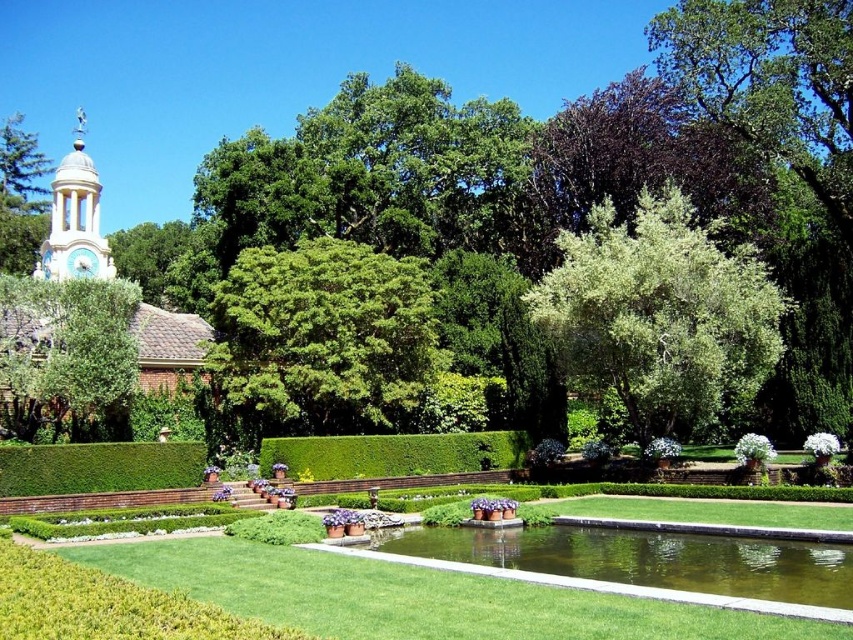
Question: Can you confirm if green concrete pond at center is smaller than green leafy tree at upper left?

Choices:
 (A) no
 (B) yes

Answer: (B)

Question: Which of the following is the farthest from the observer?

Choices:
 (A) (773, 566)
 (B) (42, 392)

Answer: (B)

Question: Is green grass at center above green concrete pond at center?

Choices:
 (A) no
 (B) yes

Answer: (B)

Question: Does green grass at center have a smaller size compared to green leafy hedge at lower left?

Choices:
 (A) yes
 (B) no

Answer: (B)

Question: Which point appears closest to the camera in this image?

Choices:
 (A) (57, 168)
 (B) (398, 470)
 (C) (308, 284)
 (D) (109, 344)

Answer: (D)

Question: Estimate the real-world distances between objects in this image. Which object is closer to the green grass at center?

Choices:
 (A) white painted stone clock tower at upper left
 (B) green leafy hedge at lower left

Answer: (B)